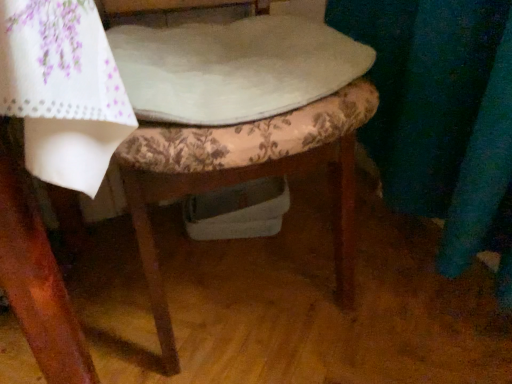
Where is `vacant space underneath floral fabric cushion at center (from a real-world perspective)`? The width and height of the screenshot is (512, 384). vacant space underneath floral fabric cushion at center (from a real-world perspective) is located at coordinates (236, 269).